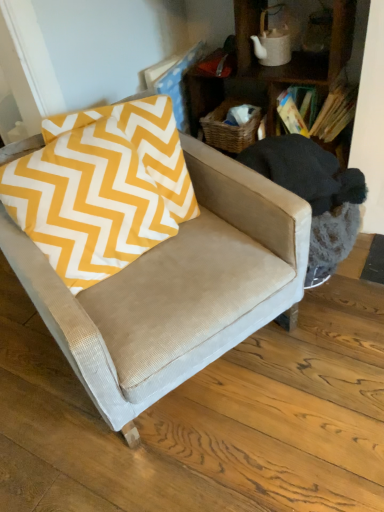
Question: Is yellow zigzag fabric pillow at left positioned in front of wooden bookshelf at upper right?

Choices:
 (A) no
 (B) yes

Answer: (B)

Question: From the image's perspective, is yellow zigzag fabric pillow at left above wooden bookshelf at upper right?

Choices:
 (A) no
 (B) yes

Answer: (A)

Question: From the image's perspective, is yellow zigzag fabric pillow at left beneath wooden bookshelf at upper right?

Choices:
 (A) no
 (B) yes

Answer: (B)

Question: Can you confirm if yellow zigzag fabric pillow at left is smaller than wooden bookshelf at upper right?

Choices:
 (A) yes
 (B) no

Answer: (A)

Question: Is yellow zigzag fabric pillow at left further to the viewer compared to wooden bookshelf at upper right?

Choices:
 (A) yes
 (B) no

Answer: (B)

Question: Is wooden bookshelf at upper right at the back of yellow zigzag fabric pillow at left?

Choices:
 (A) no
 (B) yes

Answer: (A)

Question: Is suede-like beige armchair at center at the left side of yellow zigzag fabric pillow at left?

Choices:
 (A) no
 (B) yes

Answer: (A)

Question: Is suede-like beige armchair at center thinner than yellow zigzag fabric pillow at left?

Choices:
 (A) no
 (B) yes

Answer: (A)

Question: Is suede-like beige armchair at center turned away from yellow zigzag fabric pillow at left?

Choices:
 (A) yes
 (B) no

Answer: (A)

Question: Can you confirm if suede-like beige armchair at center is wider than yellow zigzag fabric pillow at left?

Choices:
 (A) no
 (B) yes

Answer: (B)

Question: Is yellow zigzag fabric pillow at left surrounded by suede-like beige armchair at center?

Choices:
 (A) no
 (B) yes

Answer: (B)

Question: From the image's perspective, does suede-like beige armchair at center appear higher than yellow zigzag fabric pillow at left?

Choices:
 (A) no
 (B) yes

Answer: (A)

Question: Is the surface of wooden bookshelf at upper right in direct contact with suede-like beige swivel chair at center?

Choices:
 (A) yes
 (B) no

Answer: (B)